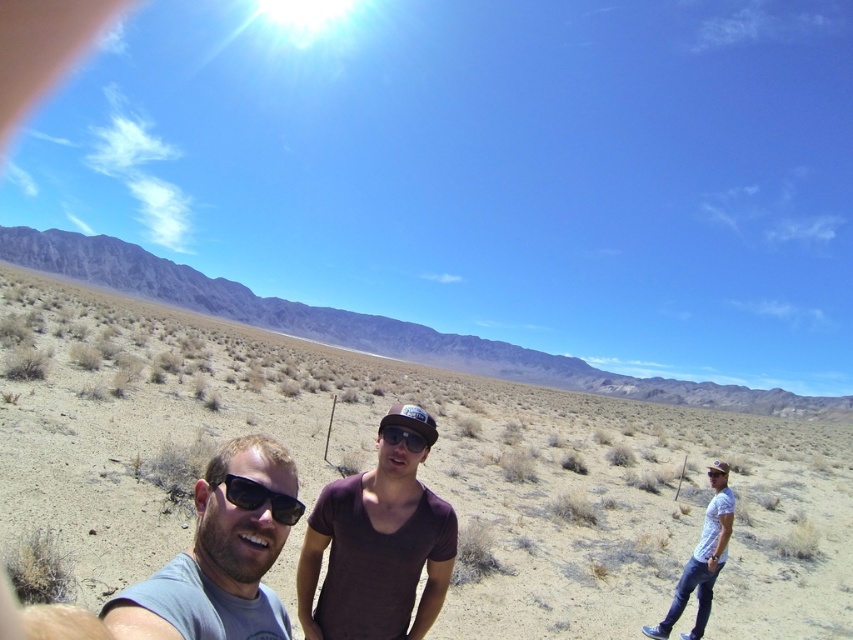
You are standing in the desert scene and want to walk from point A to point B. Point A is at coordinates point (259, 484) and point B is at coordinates point (287, 500). According to the image, which direction should you walk to move from point A to point B?

Point (259, 484) is in front of point (287, 500), so to move from point A to point B, you should walk backward towards point B.